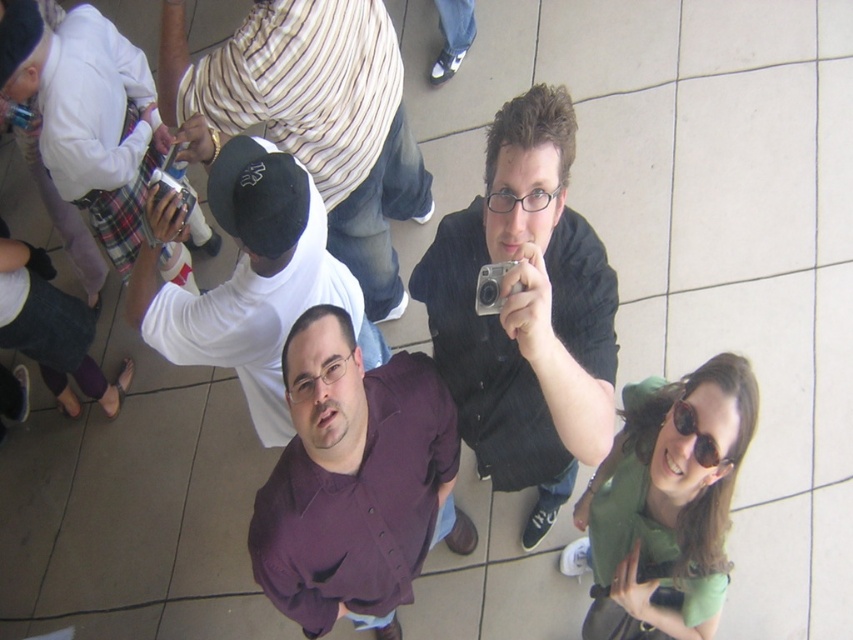
What do you see at coordinates (526, 312) in the screenshot? I see `matte black shirt at center` at bounding box center [526, 312].

Can you confirm if matte black shirt at center is positioned to the right of white matte shirt at center?

Indeed, matte black shirt at center is positioned on the right side of white matte shirt at center.

Locate an element on the screen. The image size is (853, 640). matte black shirt at center is located at coordinates (526, 312).

Find the location of a particular element. This screenshot has width=853, height=640. matte black shirt at center is located at coordinates (526, 312).

Is white matte cap at upper left further to camera compared to sunglasses at upper center?

Yes.

Is white matte cap at upper left wider than sunglasses at upper center?

Correct, the width of white matte cap at upper left exceeds that of sunglasses at upper center.

Where is `white matte cap at upper left`? The height and width of the screenshot is (640, 853). white matte cap at upper left is located at coordinates (315, 116).

Between point (566, 326) and point (85, 152), which one is positioned behind?

The point (85, 152) is behind.

In the scene shown: Who is more forward, (531, 358) or (107, 186)?

Point (531, 358) is more forward.

Where is `matte black shirt at center`? The width and height of the screenshot is (853, 640). matte black shirt at center is located at coordinates (526, 312).